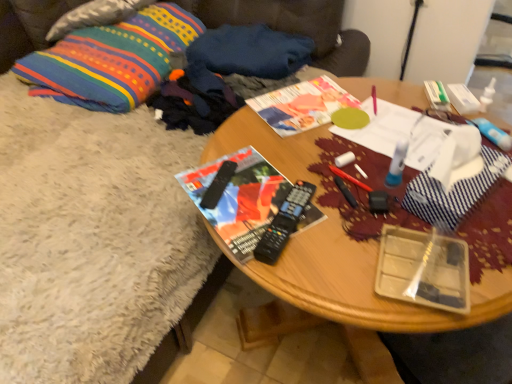
Find the location of a particular element. The image size is (512, 384). wooden table at center is located at coordinates (350, 297).

At what (x,y) coordinates should I click in order to perform the action: click on dark blue fabric at upper center, which is the second clothing in front-to-back order. Please return your answer as a coordinate pair (x, y). The width and height of the screenshot is (512, 384). Looking at the image, I should click on (251, 51).

This screenshot has width=512, height=384. What do you see at coordinates (94, 16) in the screenshot? I see `textured cotton pillow at upper left, the first pillow viewed from the top` at bounding box center [94, 16].

In order to face black plastic remote control at center, which is the 2th remote control from left to right, should I rotate leftwards or rightwards?

You should look right and rotate roughly 4.186 degrees.

Where is `black plastic remote control at center, the 1th remote control in the right-to-left sequence`? The height and width of the screenshot is (384, 512). black plastic remote control at center, the 1th remote control in the right-to-left sequence is located at coordinates (284, 223).

Locate an element on the screen. wooden table at center is located at coordinates (350, 297).

Which object is further away from the camera taking this photo, velvet fabric couch at upper left or dark blue fleece socks at upper left, marked as the second clothing in a back-to-front arrangement?

Positioned behind is dark blue fleece socks at upper left, marked as the second clothing in a back-to-front arrangement.

How many degrees apart are the facing directions of velvet fabric couch at upper left and dark blue fleece socks at upper left, marked as the second clothing in a back-to-front arrangement?

The facing directions of velvet fabric couch at upper left and dark blue fleece socks at upper left, marked as the second clothing in a back-to-front arrangement, are 3.27 degrees apart.

Is velvet fabric couch at upper left not inside dark blue fleece socks at upper left, marked as the second clothing in a back-to-front arrangement?

Yes, velvet fabric couch at upper left is outside of dark blue fleece socks at upper left, marked as the second clothing in a back-to-front arrangement.

Can you confirm if velvet fabric couch at upper left is bigger than dark blue fleece socks at upper left, marked as the second clothing in a back-to-front arrangement?

Indeed, velvet fabric couch at upper left has a larger size compared to dark blue fleece socks at upper left, marked as the second clothing in a back-to-front arrangement.

Is multicolored woven pillow at upper left, positioned as the 1th pillow in bottom-to-top order, to the left or to the right of velvet fabric couch at upper left in the image?

From the image, it's evident that multicolored woven pillow at upper left, positioned as the 1th pillow in bottom-to-top order, is to the right of velvet fabric couch at upper left.

Do you think multicolored woven pillow at upper left, the second pillow from the top, is within velvet fabric couch at upper left, or outside of it?

The correct answer is: inside.

Does multicolored woven pillow at upper left, the second pillow from the top, have a lesser height compared to velvet fabric couch at upper left?

Correct, multicolored woven pillow at upper left, the second pillow from the top, is not as tall as velvet fabric couch at upper left.

From a real-world perspective, is dark blue fleece socks at upper left, marked as the second clothing in a back-to-front arrangement, located higher than matte paper magazine at center?

Incorrect, from a real-world perspective, dark blue fleece socks at upper left, marked as the second clothing in a back-to-front arrangement, is lower than matte paper magazine at center.

Is dark blue fleece socks at upper left, marked as the second clothing in a back-to-front arrangement, facing towards matte paper magazine at center?

Yes, dark blue fleece socks at upper left, marked as the second clothing in a back-to-front arrangement, is oriented towards matte paper magazine at center.

Which of these two, dark blue fleece socks at upper left, marked as the second clothing in a back-to-front arrangement, or matte paper magazine at center, is bigger?

Bigger between the two is dark blue fleece socks at upper left, marked as the second clothing in a back-to-front arrangement.

Considering the positions of objects dark blue fleece socks at upper left, the first clothing viewed from the front, and matte paper magazine at center in the image provided, who is more to the right, dark blue fleece socks at upper left, the first clothing viewed from the front, or matte paper magazine at center?

matte paper magazine at center is more to the right.

Between matte black magazine at center and dark blue fleece socks at upper left, the first clothing viewed from the front, which one has smaller size?

matte black magazine at center is smaller.

How different are the orientations of matte black magazine at center and dark blue fleece socks at upper left, the first clothing viewed from the front, in degrees?

57.8 degrees separate the facing orientations of matte black magazine at center and dark blue fleece socks at upper left, the first clothing viewed from the front.

Visually, is matte black magazine at center positioned to the left or to the right of dark blue fleece socks at upper left, the first clothing viewed from the front?

In the image, matte black magazine at center appears on the right side of dark blue fleece socks at upper left, the first clothing viewed from the front.

Between point (248, 221) and point (192, 80), which one is positioned in front?

The point (248, 221) is closer.

Considering the sizes of objects matte paper magazine at center and black plastic remote control at center, which is the 2th remote control from left to right, in the image provided, who is bigger, matte paper magazine at center or black plastic remote control at center, which is the 2th remote control from left to right,?

With larger size is matte paper magazine at center.

Is matte paper magazine at center inside the boundaries of black plastic remote control at center, which is the 2th remote control from left to right, or outside?

matte paper magazine at center exists outside the volume of black plastic remote control at center, which is the 2th remote control from left to right.

Is matte paper magazine at center positioned far away from black plastic remote control at center, the 1th remote control in the right-to-left sequence?

That's not correct — matte paper magazine at center is a little close to black plastic remote control at center, the 1th remote control in the right-to-left sequence.

Consider the image. Can you confirm if dark blue fleece socks at upper left, the first clothing viewed from the front, is positioned to the left of wooden table at center?

Correct, you'll find dark blue fleece socks at upper left, the first clothing viewed from the front, to the left of wooden table at center.

Looking at the image, does dark blue fleece socks at upper left, the first clothing viewed from the front, seem bigger or smaller compared to wooden table at center?

dark blue fleece socks at upper left, the first clothing viewed from the front, is smaller than wooden table at center.

Is dark blue fleece socks at upper left, the first clothing viewed from the front, wider or thinner than wooden table at center?

dark blue fleece socks at upper left, the first clothing viewed from the front, is thinner than wooden table at center.

From the image's perspective, is dark blue fleece socks at upper left, the first clothing viewed from the front, above or below wooden table at center?

dark blue fleece socks at upper left, the first clothing viewed from the front, is situated higher than wooden table at center in the image.

Is velvet fabric couch at upper left looking in the opposite direction of black plastic remote control at center, the 1th remote control positioned from the left?

No, velvet fabric couch at upper left is not facing the opposite direction of black plastic remote control at center, the 1th remote control positioned from the left.

Between velvet fabric couch at upper left and black plastic remote control at center, the 1th remote control positioned from the left, which one has smaller size?

black plastic remote control at center, the 1th remote control positioned from the left.

From the image's perspective, starting from the velvet fabric couch at upper left, which remote control is the 1st one below? Please provide its 2D coordinates.

[(218, 185)]

Does point (249, 3) come farther from viewer compared to point (223, 185)?

Yes.

What are the coordinates of `clothing below the velvet fabric couch at upper left (from the image's perspective)` in the screenshot? It's located at pos(226,73).

From the image's perspective, count 1st pillows upward from the velvet fabric couch at upper left and point to it. Please provide its 2D coordinates.

[(111, 60)]

When comparing their distances from black plastic remote control at center, which is the 2th remote control from left to right, does matte black magazine at center or wooden table at center seem further?

wooden table at center lies further to black plastic remote control at center, which is the 2th remote control from left to right, than the other object.

From the image, which object appears to be nearer to dark blue fabric at upper center, the 1th clothing when ordered from back to front, matte black magazine at center or wooden table at center?

Among the two, wooden table at center is located nearer to dark blue fabric at upper center, the 1th clothing when ordered from back to front.

From the image, which object appears to be farther from dark blue fleece socks at upper left, the first clothing viewed from the front, velvet fabric couch at upper left or matte black magazine at center?

Among the two, matte black magazine at center is located further to dark blue fleece socks at upper left, the first clothing viewed from the front.

Considering their positions, is wooden table at center positioned further to matte paper magazine at center than multicolored woven pillow at upper left, the second pillow from the top?

multicolored woven pillow at upper left, the second pillow from the top, lies further to matte paper magazine at center than the other object.

Estimate the real-world distances between objects in this image. Which object is further from matte black magazine at center, wooden table at center or black plastic remote control at center, which is the 2th remote control in right-to-left order?

Among the two, wooden table at center is located further to matte black magazine at center.

When comparing their distances from textured cotton pillow at upper left, which is counted as the 2th pillow, starting from the bottom, does black plastic remote control at center, the 1th remote control in the right-to-left sequence, or dark blue fleece socks at upper left, the first clothing viewed from the front, seem closer?

The object closer to textured cotton pillow at upper left, which is counted as the 2th pillow, starting from the bottom, is dark blue fleece socks at upper left, the first clothing viewed from the front.

Consider the image. When comparing their distances from black plastic remote control at center, which is the 2th remote control from left to right, does textured cotton pillow at upper left, which is counted as the 2th pillow, starting from the bottom, or wooden table at center seem closer?

wooden table at center.

In the scene shown: Considering their positions, is multicolored woven pillow at upper left, positioned as the 1th pillow in bottom-to-top order, positioned further to velvet fabric couch at upper left than textured cotton pillow at upper left, the first pillow viewed from the top?

multicolored woven pillow at upper left, positioned as the 1th pillow in bottom-to-top order, is positioned further to the anchor velvet fabric couch at upper left.

Locate an element on the screen. This screenshot has width=512, height=384. magazine situated between velvet fabric couch at upper left and wooden table at center from left to right is located at coordinates (239, 199).

Find the location of a particular element. The image size is (512, 384). clothing between velvet fabric couch at upper left and dark blue fabric at upper center, the 1th clothing when ordered from back to front, from front to back is located at coordinates (226, 73).

Where is `magazine between velvet fabric couch at upper left and dark blue fleece socks at upper left, the first clothing viewed from the front, along the z-axis`? magazine between velvet fabric couch at upper left and dark blue fleece socks at upper left, the first clothing viewed from the front, along the z-axis is located at coordinates (239, 199).

Where is `magazine between textured cotton pillow at upper left, the first pillow viewed from the top, and black plastic remote control at center, which is the 2th remote control from left to right, from top to bottom`? The image size is (512, 384). magazine between textured cotton pillow at upper left, the first pillow viewed from the top, and black plastic remote control at center, which is the 2th remote control from left to right, from top to bottom is located at coordinates (239, 199).